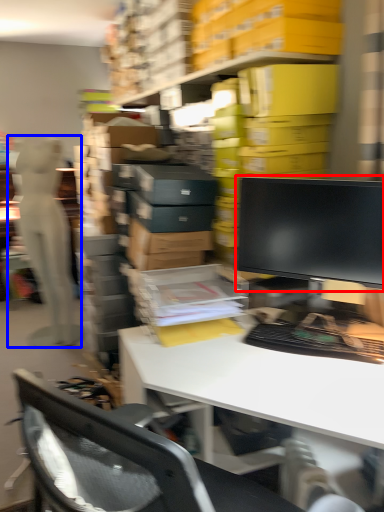
Question: Which object appears closest to the camera in this image, computer monitor (highlighted by a red box) or person (highlighted by a blue box)?

Choices:
 (A) computer monitor
 (B) person

Answer: (A)